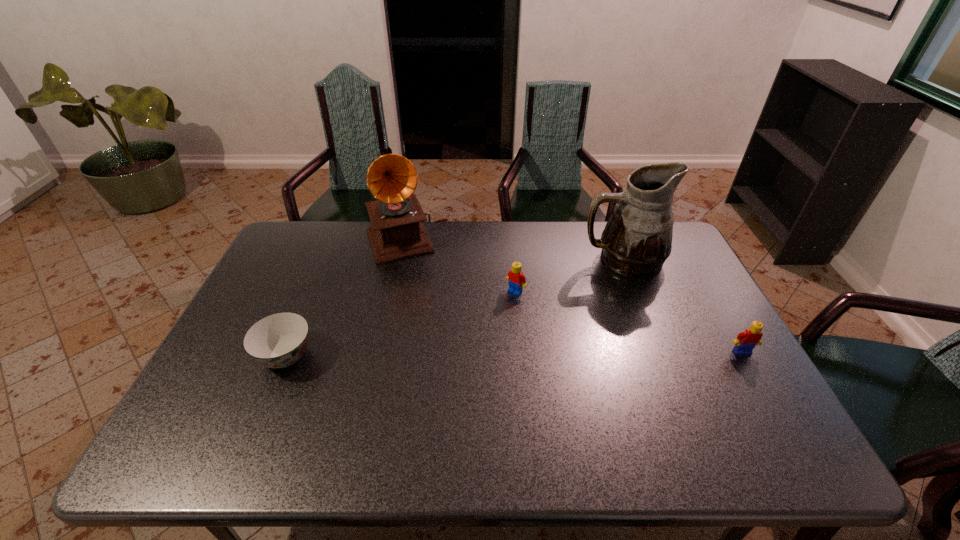
The width and height of the screenshot is (960, 540). Find the location of `pitcher positioned at the far edge`. pitcher positioned at the far edge is located at coordinates (637, 239).

Find the location of a particular element. The width and height of the screenshot is (960, 540). object that is at the left edge is located at coordinates (278, 340).

The height and width of the screenshot is (540, 960). I want to click on Lego located at the right edge, so click(x=746, y=341).

The width and height of the screenshot is (960, 540). In order to click on pitcher at the right edge in this screenshot , I will do `click(637, 239)`.

Identify the location of object that is at the far right corner. The height and width of the screenshot is (540, 960). (637, 239).

This screenshot has height=540, width=960. In the image, there is a desktop. What are the coordinates of `blank space at the far edge` in the screenshot? It's located at (478, 249).

This screenshot has height=540, width=960. Identify the location of vacant region at the near edge of the desktop. (330, 408).

Image resolution: width=960 pixels, height=540 pixels. Find the location of `free location at the left edge`. free location at the left edge is located at coordinates (289, 301).

Image resolution: width=960 pixels, height=540 pixels. In the image, there is a desktop. What are the coordinates of `vacant space at the right edge` in the screenshot? It's located at (696, 347).

Where is `free spot at the far left corner of the desktop`? Image resolution: width=960 pixels, height=540 pixels. free spot at the far left corner of the desktop is located at coordinates (287, 252).